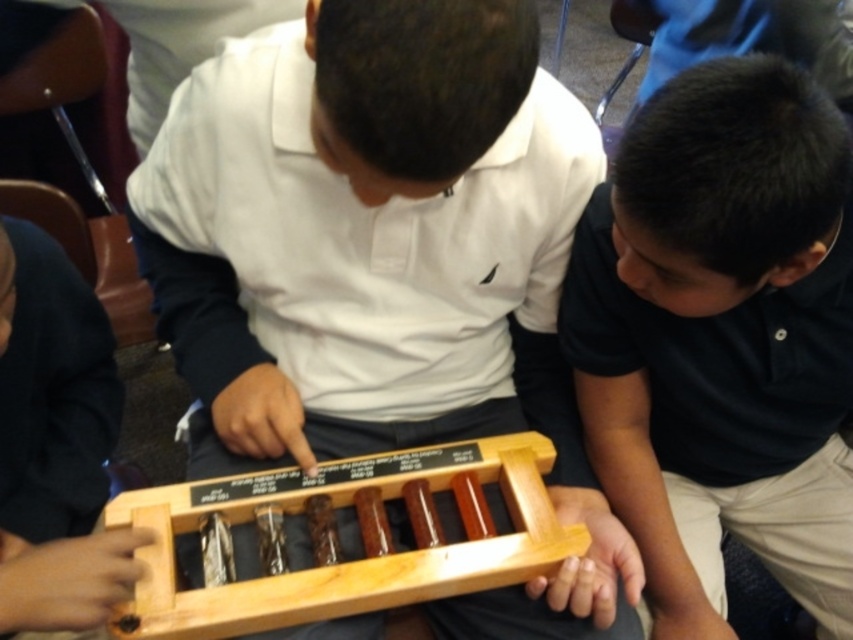
You are a researcher observing the scene. You notice the wooden tray at center and the black matte shirt at center. Which object is taller in this setup?

The wooden tray at center is much taller than the black matte shirt at center.

Where is the wooden tray at center located in the image?

The wooden tray at center is located at point coordinates of 0.359 in the x axis and 0.426 in the y axis.

You are standing in a lab and need to reach the wooden tray at center to retrieve a test tube. If your arm can extend 20 inches, can you reach it?

The wooden tray at center is 20.77 inches away from the viewer. Since your arm can only extend 20 inches, you cannot reach it without moving closer.